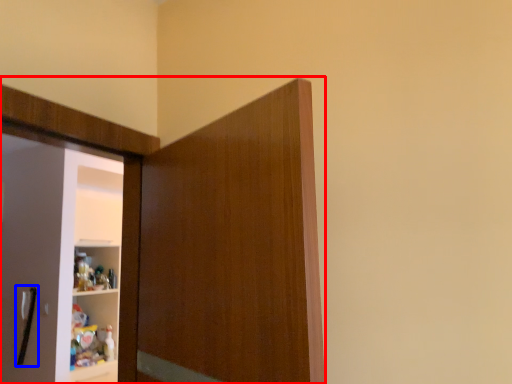
Question: Which of the following is the farthest to the observer, cupboard (highlighted by a red box) or door handle (highlighted by a blue box)?

Choices:
 (A) cupboard
 (B) door handle

Answer: (B)